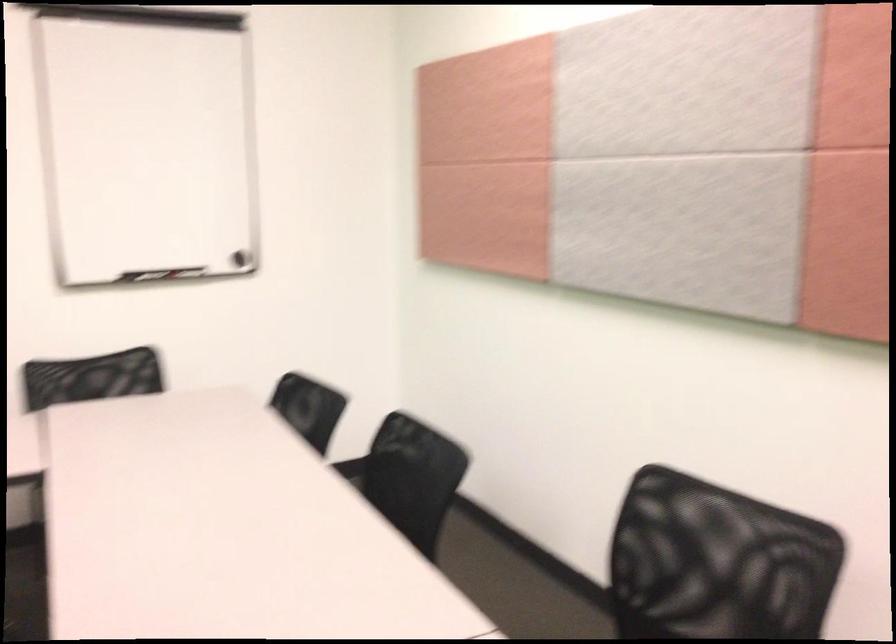
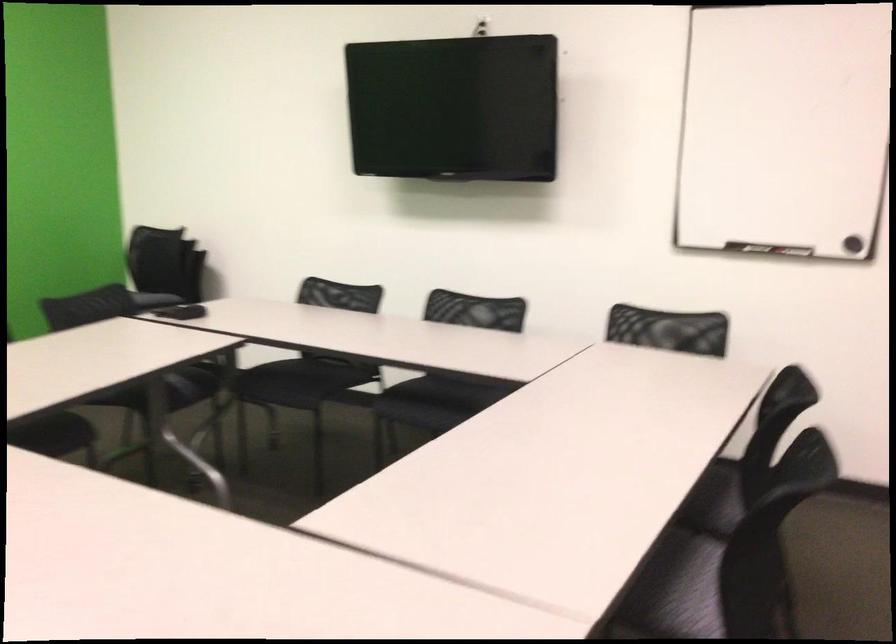
Question: The camera is either moving clockwise (left) or counter-clockwise (right) around the object. The first image is from the beginning of the video and the second image is from the end. Is the camera moving left or right when shooting the video?

Choices:
 (A) Left
 (B) Right

Answer: (B)